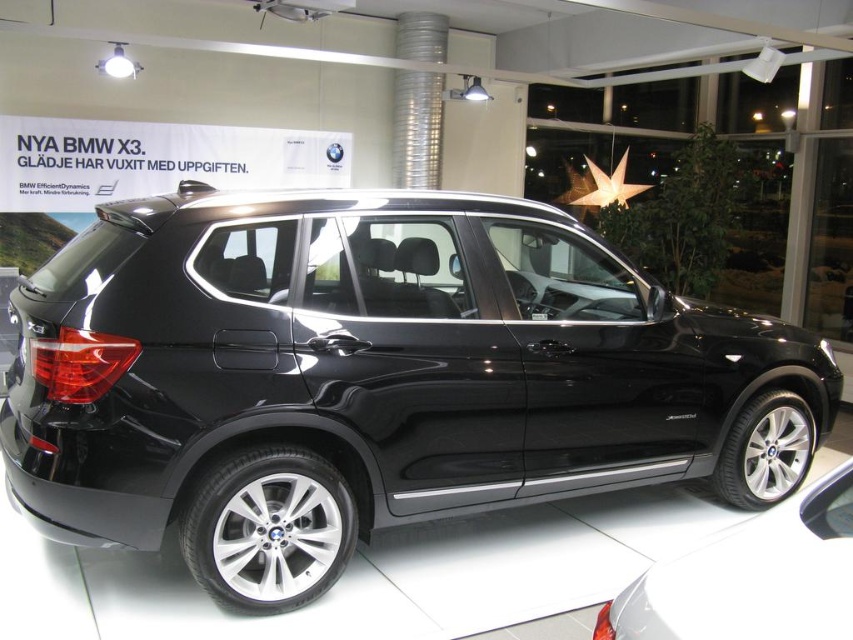
Does point (485, 317) come behind point (692, 566)?

Yes, point (485, 317) is farther from viewer.

Who is more forward, [96,413] or [809,570]?

Point [809,570] is in front.

Is point (668, 388) positioned after point (848, 588)?

Yes, point (668, 388) is farther from viewer.

In order to click on glossy black suv at center in this screenshot , I will do `click(373, 378)`.